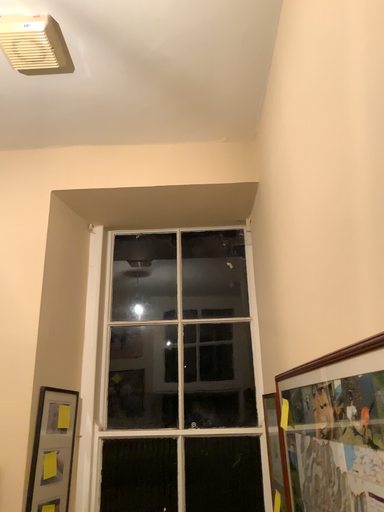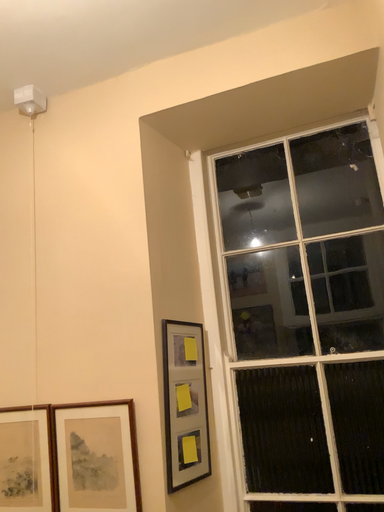
Question: How did the camera likely rotate when shooting the video?

Choices:
 (A) rotated left
 (B) rotated right

Answer: (A)